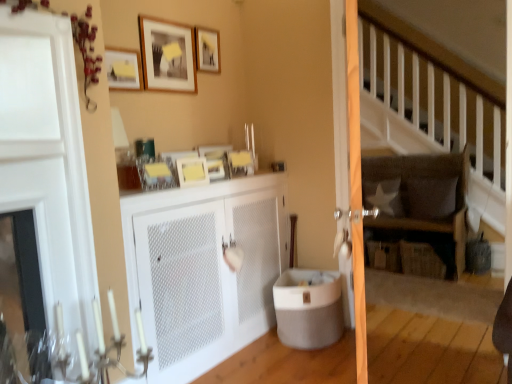
Question: Are white mesh cabinet at center and matte white screen door at center making contact?

Choices:
 (A) no
 (B) yes

Answer: (A)

Question: From the image's perspective, does white mesh cabinet at center appear lower than matte white screen door at center?

Choices:
 (A) yes
 (B) no

Answer: (A)

Question: Is white mesh cabinet at center to the right of matte white screen door at center from the viewer's perspective?

Choices:
 (A) yes
 (B) no

Answer: (B)

Question: From the image's perspective, does white mesh cabinet at center appear higher than matte white screen door at center?

Choices:
 (A) no
 (B) yes

Answer: (A)

Question: Considering the relative sizes of white mesh cabinet at center and matte white screen door at center in the image provided, is white mesh cabinet at center smaller than matte white screen door at center?

Choices:
 (A) no
 (B) yes

Answer: (A)

Question: From a real-world perspective, is white mesh cabinet at center on matte white screen door at center?

Choices:
 (A) yes
 (B) no

Answer: (B)

Question: Considering the relative positions of matte wooden picture frame at upper center, the first picture frame in the top-to-bottom sequence, and matte gray tub at lower center in the image provided, is matte wooden picture frame at upper center, the first picture frame in the top-to-bottom sequence, to the left of matte gray tub at lower center from the viewer's perspective?

Choices:
 (A) no
 (B) yes

Answer: (B)

Question: Can you confirm if matte wooden picture frame at upper center, the 4th picture frame in the bottom-to-top sequence, is shorter than matte gray tub at lower center?

Choices:
 (A) no
 (B) yes

Answer: (B)

Question: Can you confirm if matte wooden picture frame at upper center, the 4th picture frame in the bottom-to-top sequence, is wider than matte gray tub at lower center?

Choices:
 (A) no
 (B) yes

Answer: (A)

Question: Are matte wooden picture frame at upper center, the first picture frame in the top-to-bottom sequence, and matte gray tub at lower center beside each other?

Choices:
 (A) no
 (B) yes

Answer: (A)

Question: Is matte wooden picture frame at upper center, the first picture frame in the top-to-bottom sequence, closer to the viewer compared to matte gray tub at lower center?

Choices:
 (A) no
 (B) yes

Answer: (A)

Question: Is matte wooden picture frame at upper center, the first picture frame in the top-to-bottom sequence, taller than matte gray tub at lower center?

Choices:
 (A) yes
 (B) no

Answer: (B)

Question: From the image's perspective, is matte yellow picture frame at upper left, placed as the 3th picture frame when sorted from top to bottom, on top of matte yellow picture frame at upper center, positioned as the fourth picture frame in top-to-bottom order?

Choices:
 (A) yes
 (B) no

Answer: (A)